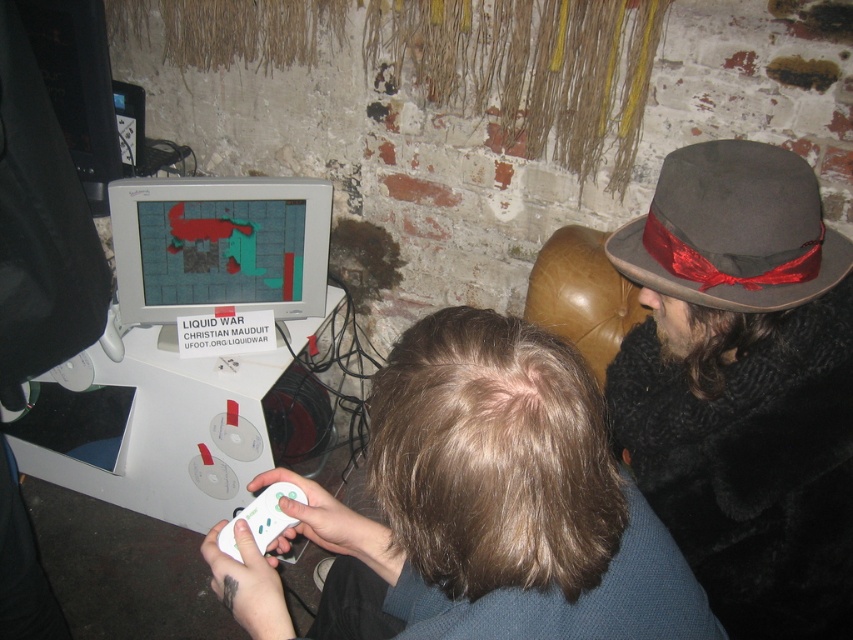
You are standing in front of the monitor playing Liquid War. You need to pick up the white plastic game controller at lower center to continue. Can you reach it without moving the dark brown felt fedora at right?

The dark brown felt fedora at right is closer to the viewer than the white plastic game controller at lower center, so you can reach the white plastic game controller at lower center without moving the fedora because it is farther away.

Based on the photo, you are a photographer taking a picture of the two gamers. You notice the dark brown hair at center and the dark brown felt fedora at right in your frame. Which object should you adjust to ensure both are fully visible in the photo?

The dark brown felt fedora at right should be adjusted because it is positioned above the dark brown hair at center, potentially blocking part of it. Lowering the fedora or tilting the camera slightly could help capture both elements clearly.

You are a photographer taking a picture of the two gamers. You notice the dark brown hair at center and the dark brown felt fedora at right in your frame. Which object in the scene is wider?

The dark brown hair at center is wider than the dark brown felt fedora at right.